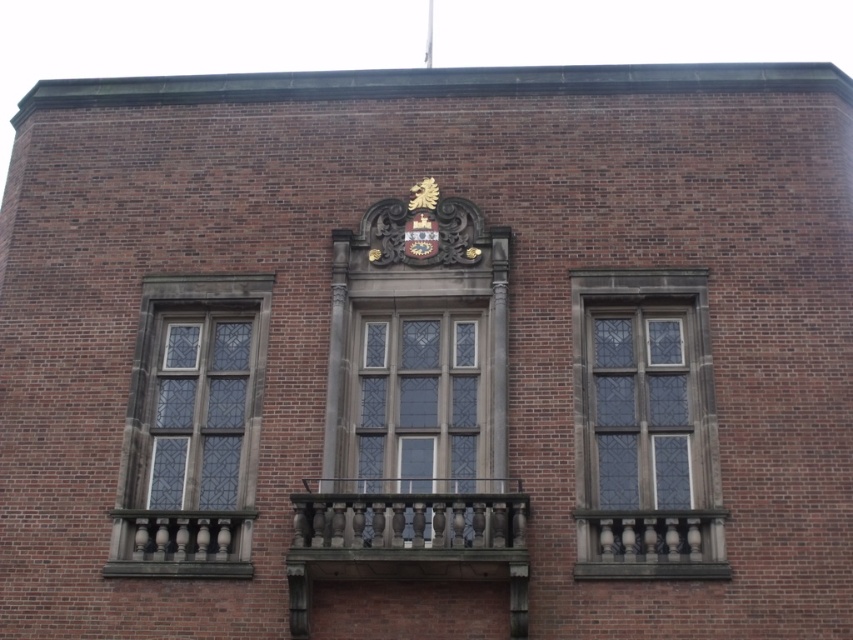
You are standing in front of the brick building and want to look through the clear glass window at left. To do so, you need to stand on the brown polished wood balcony at center. Is the window accessible from the balcony?

The clear glass window at left is above the brown polished wood balcony at center, so you can access it by standing on the balcony.

From the picture: You are a maintenance worker inspecting the building facade. You need to access the brown polished wood balcony at center and the polished stone balcony at center. Which one is located higher up on the building?

The brown polished wood balcony at center is above the polished stone balcony at center, so it is located higher up on the building.